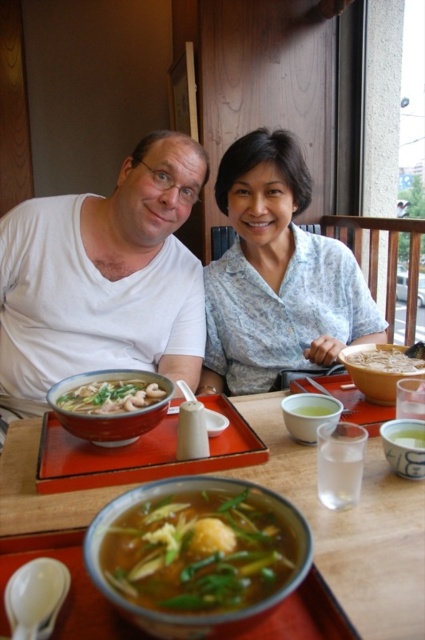
Question: Which of these objects is positioned farthest from the white matte shirt at upper left?

Choices:
 (A) matte ceramic bowl at lower left
 (B) green matte bowl at center
 (C) translucent glass table at center

Answer: (B)

Question: Can you confirm if green leafy soup at center is smaller than white matte bowl at center?

Choices:
 (A) yes
 (B) no

Answer: (A)

Question: Is matte ceramic bowl at lower left to the right of matte ceramic bowl at center from the viewer's perspective?

Choices:
 (A) no
 (B) yes

Answer: (A)

Question: Based on their relative distances, which object is nearer to the matte ceramic bowl at center?

Choices:
 (A) translucent broth bowl at center
 (B) matte ceramic bowl at lower left

Answer: (B)

Question: Which point appears closest to the camera in this image?

Choices:
 (A) (93, 413)
 (B) (85, 388)

Answer: (A)

Question: Does porcelain white bowl at center appear over green translucent soup at center?

Choices:
 (A) yes
 (B) no

Answer: (B)